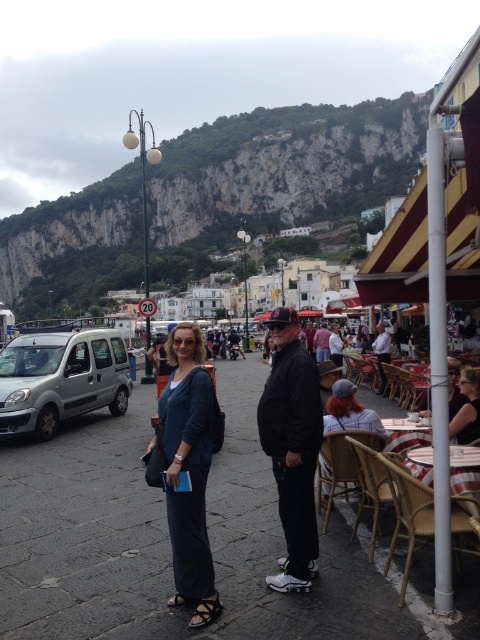
Question: Can you confirm if matte black sunglasses at center is bigger than leather sandal at lower center?

Choices:
 (A) yes
 (B) no

Answer: (A)

Question: Is plaid shirt at center thinner than leather sandal at lower center?

Choices:
 (A) no
 (B) yes

Answer: (A)

Question: Among these points, which one is nearest to the camera?

Choices:
 (A) (157, 440)
 (B) (118, 368)

Answer: (A)

Question: Can you confirm if plaid shirt at center is smaller than matte black sunglasses at center?

Choices:
 (A) no
 (B) yes

Answer: (A)

Question: Among these points, which one is nearest to the camera?

Choices:
 (A) (479, 433)
 (B) (91, 403)

Answer: (A)

Question: Which object is farther from the camera taking this photo?

Choices:
 (A) leather sandal at lower center
 (B) matte black sunglasses at center
 (C) plaid shirt at center

Answer: (B)